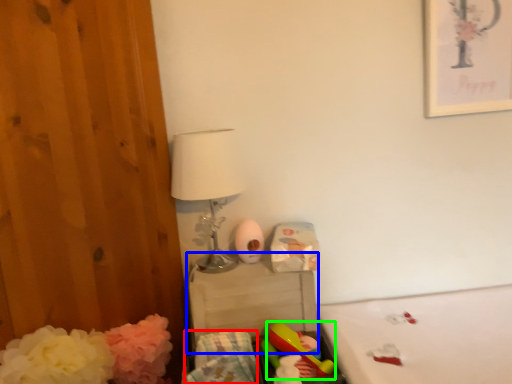
Question: Which object is the closest to the material (highlighted by a red box)? Choose among these: changing table (highlighted by a blue box) or toy (highlighted by a green box).

Choices:
 (A) changing table
 (B) toy

Answer: (B)